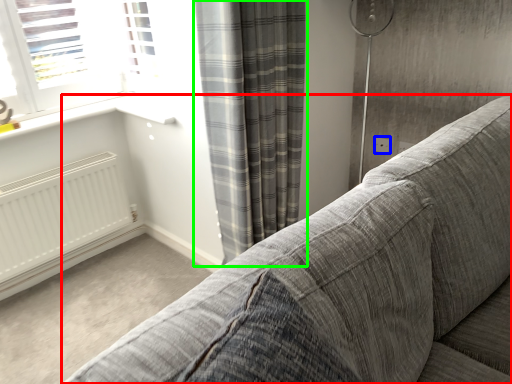
Question: Which object is the farthest from studio couch (highlighted by a red box)? Choose among these: electric outlet (highlighted by a blue box) or curtain (highlighted by a green box).

Choices:
 (A) electric outlet
 (B) curtain

Answer: (A)